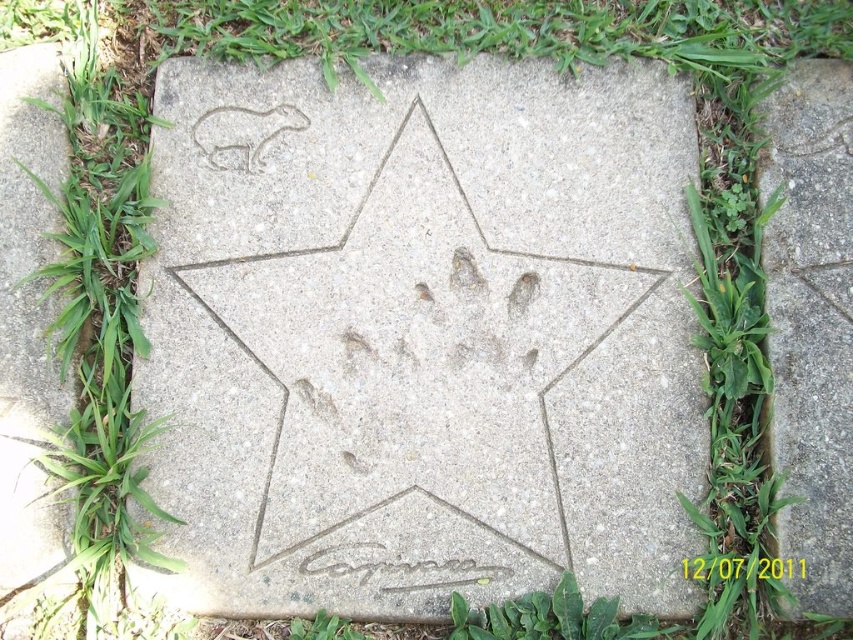
Question: Which of the following is the closest to the observer?

Choices:
 (A) green leafy grass at upper left
 (B) white stone carving at upper left

Answer: (A)

Question: Which point is closer to the camera?

Choices:
 (A) green leafy grass at upper left
 (B) white stone carving at upper left

Answer: (A)

Question: Can you confirm if green leafy grass at upper left is positioned to the right of white stone carving at upper left?

Choices:
 (A) yes
 (B) no

Answer: (B)

Question: Can you confirm if green leafy grass at upper left is thinner than white stone carving at upper left?

Choices:
 (A) yes
 (B) no

Answer: (B)

Question: Which point is farther to the camera?

Choices:
 (A) white stone carving at upper left
 (B) green leafy grass at upper left

Answer: (A)

Question: Is green leafy grass at upper left closer to camera compared to white stone carving at upper left?

Choices:
 (A) no
 (B) yes

Answer: (B)